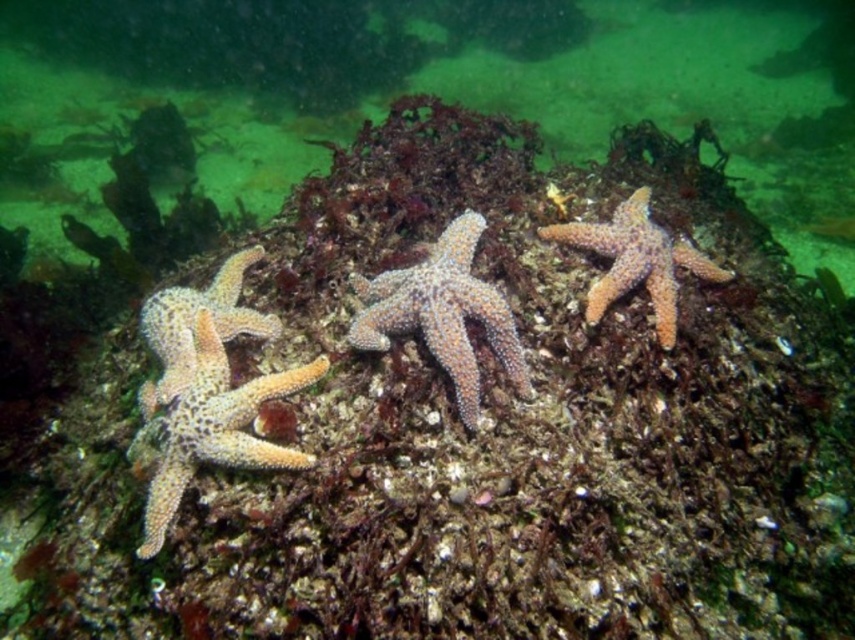
Question: Does orange rough starfish at left have a larger size compared to orange spiny starfish at left?

Choices:
 (A) yes
 (B) no

Answer: (A)

Question: Which object is positioned closest to the orange spiny starfish at center?

Choices:
 (A) orange rough starfish at left
 (B) orange spiny starfish at upper right
 (C) orange spiny starfish at left

Answer: (A)

Question: Can you confirm if orange spiny starfish at center is smaller than orange spiny starfish at upper right?

Choices:
 (A) yes
 (B) no

Answer: (A)

Question: Which point is farther from the camera taking this photo?

Choices:
 (A) (606, 237)
 (B) (526, 368)
 (C) (210, 416)
 (D) (152, 384)

Answer: (A)

Question: Can you confirm if orange spiny starfish at center is thinner than orange spiny starfish at upper right?

Choices:
 (A) no
 (B) yes

Answer: (B)

Question: Which point is farther to the camera?

Choices:
 (A) (166, 468)
 (B) (620, 234)
 (C) (370, 312)
 (D) (222, 284)

Answer: (D)